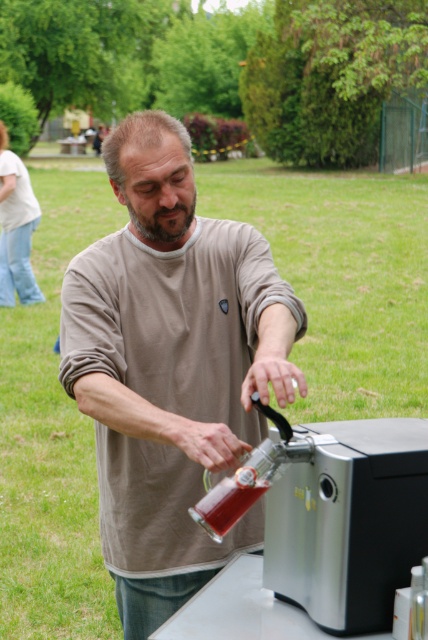
You are a photographer trying to capture a closeup of both the matte brown shirt at center and the translucent glass bottle at center. Given that your camera can focus on objects within a 40 cm range, will you be able to get both in focus at the same time?

The matte brown shirt at center and the translucent glass bottle at center are 42.88 centimeters apart from each other. Since the distance between them exceeds the camera focus range of 40 cm, you won